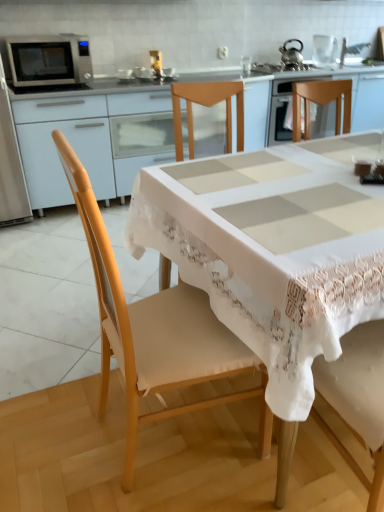
Question: Could you tell me if matte white cabinet at upper left is facing metallic silver spoon at upper center?

Choices:
 (A) yes
 (B) no

Answer: (B)

Question: Does matte white cabinet at upper left have a greater width compared to metallic silver spoon at upper center?

Choices:
 (A) no
 (B) yes

Answer: (B)

Question: From the image's perspective, does matte white cabinet at upper left appear lower than metallic silver spoon at upper center?

Choices:
 (A) no
 (B) yes

Answer: (B)

Question: From a real-world perspective, is matte white cabinet at upper left on metallic silver spoon at upper center?

Choices:
 (A) yes
 (B) no

Answer: (B)

Question: Is matte white cabinet at upper left bigger than metallic silver spoon at upper center?

Choices:
 (A) no
 (B) yes

Answer: (B)

Question: Is matte white cabinet at upper left looking in the opposite direction of metallic silver spoon at upper center?

Choices:
 (A) no
 (B) yes

Answer: (A)

Question: Considering the relative sizes of clear glass kettle at upper center, which is counted as the 1th appliance, starting from the top, and metallic silver spoon at upper center in the image provided, is clear glass kettle at upper center, which is counted as the 1th appliance, starting from the top, bigger than metallic silver spoon at upper center?

Choices:
 (A) no
 (B) yes

Answer: (B)

Question: Is clear glass kettle at upper center, the second appliance positioned from the bottom, further to camera compared to metallic silver spoon at upper center?

Choices:
 (A) no
 (B) yes

Answer: (B)

Question: Does clear glass kettle at upper center, the second appliance from the front, have a lesser height compared to metallic silver spoon at upper center?

Choices:
 (A) no
 (B) yes

Answer: (A)

Question: Does clear glass kettle at upper center, marked as the second appliance in a left-to-right arrangement, have a greater width compared to metallic silver spoon at upper center?

Choices:
 (A) no
 (B) yes

Answer: (B)

Question: Could you tell me if clear glass kettle at upper center, which is counted as the 1th appliance, starting from the top, is turned towards metallic silver spoon at upper center?

Choices:
 (A) no
 (B) yes

Answer: (B)

Question: Considering the relative positions of clear glass kettle at upper center, marked as the second appliance in a left-to-right arrangement, and metallic silver spoon at upper center in the image provided, is clear glass kettle at upper center, marked as the second appliance in a left-to-right arrangement, to the left of metallic silver spoon at upper center from the viewer's perspective?

Choices:
 (A) no
 (B) yes

Answer: (A)

Question: From a real-world perspective, is wooden chair at center positioned under clear glass kettle at upper center, which is counted as the 1th appliance, starting from the top, based on gravity?

Choices:
 (A) no
 (B) yes

Answer: (B)